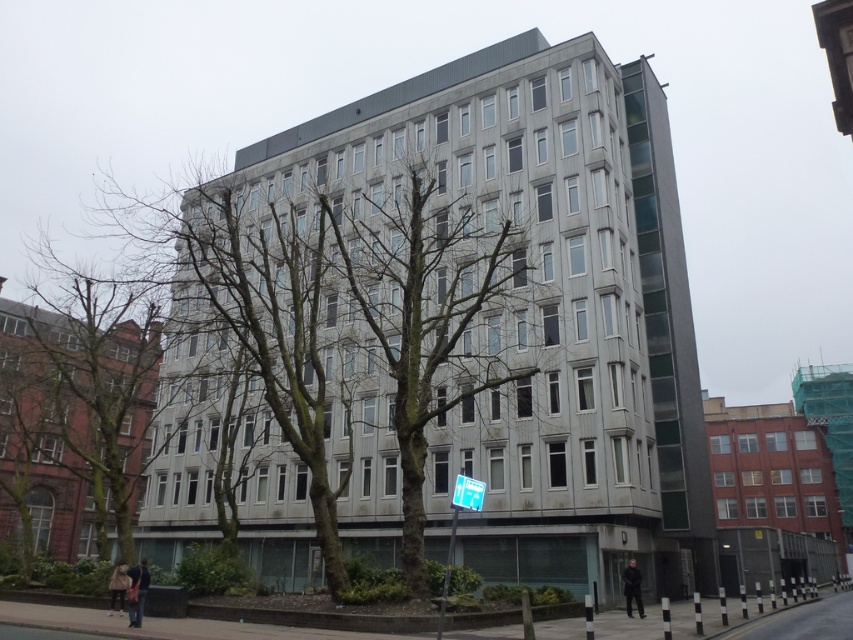
Is blue plastic sign at lower center thinner than white plastic street sign at center?

No, blue plastic sign at lower center is not thinner than white plastic street sign at center.

Who is shorter, blue plastic sign at lower center or white plastic street sign at center?

white plastic street sign at center is shorter.

Who is more distant from viewer, (445, 570) or (471, 508)?

Positioned behind is point (445, 570).

Locate an element on the screen. This screenshot has height=640, width=853. blue plastic sign at lower center is located at coordinates (456, 525).

Does bare wood tree at center lie behind white plastic street sign at center?

Yes, bare wood tree at center is further from the viewer.

Identify the location of bare wood tree at center. This screenshot has height=640, width=853. (428, 312).

Locate an element on the screen. The height and width of the screenshot is (640, 853). bare wood tree at center is located at coordinates (428, 312).

Does bare wood tree at center appear on the right side of blue plastic sign at lower center?

No, bare wood tree at center is not to the right of blue plastic sign at lower center.

Between point (403, 520) and point (450, 547), which one is positioned behind?

Point (450, 547)

Is point (402, 403) positioned behind point (454, 534)?

No.

In order to click on bare wood tree at center in this screenshot , I will do `click(428, 312)`.